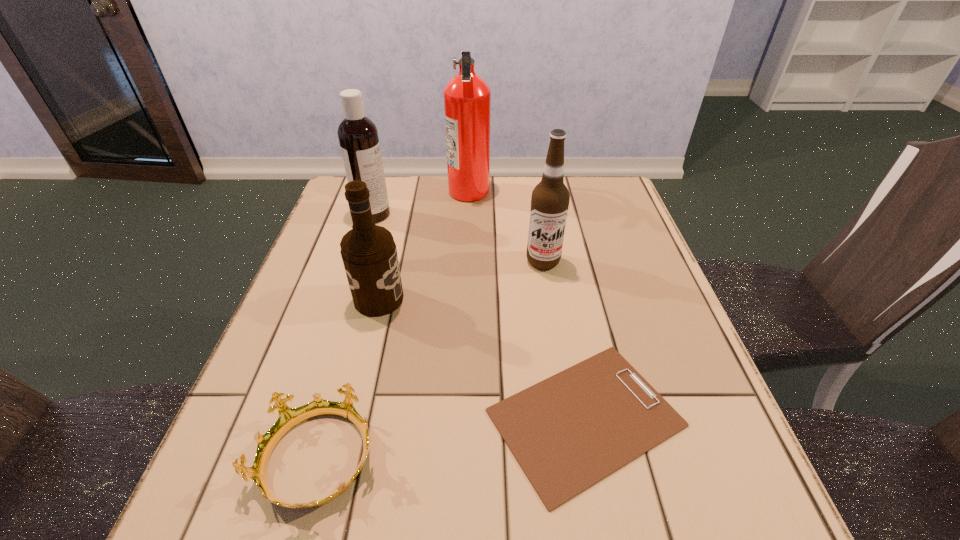
Image resolution: width=960 pixels, height=540 pixels. I want to click on the tallest object, so click(467, 97).

Where is `dishwasher detergent`? dishwasher detergent is located at coordinates (358, 137).

Where is `the third farthest object`? the third farthest object is located at coordinates (550, 199).

Where is `the right alcohol`? This screenshot has width=960, height=540. the right alcohol is located at coordinates pos(550,199).

I want to click on the left alcohol, so click(x=369, y=254).

Find the location of a particular element. The width and height of the screenshot is (960, 540). the third shortest object is located at coordinates (369, 254).

At what (x,y) coordinates should I click in order to perform the action: click on crown. Please return your answer as a coordinate pair (x, y). Looking at the image, I should click on (288, 418).

Find the location of a particular element. clipboard is located at coordinates (568, 432).

Locate an element on the screen. free location located at the nozzle of the tallest object is located at coordinates (546, 191).

I want to click on vacant region located on the label side of the dishwasher detergent, so click(x=514, y=214).